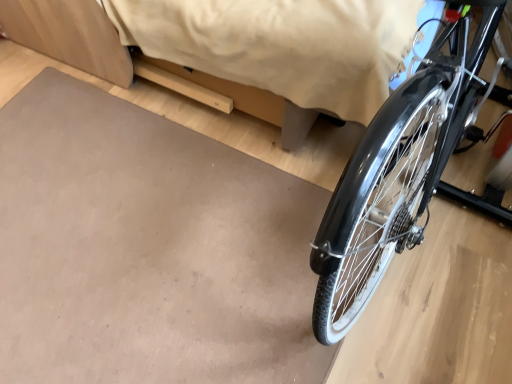
Question: Is matte gray mat at lower right shorter than matte beige bed at upper center?

Choices:
 (A) no
 (B) yes

Answer: (B)

Question: Considering the relative sizes of matte gray mat at lower right and matte beige bed at upper center in the image provided, is matte gray mat at lower right smaller than matte beige bed at upper center?

Choices:
 (A) yes
 (B) no

Answer: (A)

Question: Is matte gray mat at lower right in front of matte beige bed at upper center?

Choices:
 (A) no
 (B) yes

Answer: (A)

Question: Does matte gray mat at lower right have a larger size compared to matte beige bed at upper center?

Choices:
 (A) no
 (B) yes

Answer: (A)

Question: Is matte beige bed at upper center inside matte gray mat at lower right?

Choices:
 (A) no
 (B) yes

Answer: (A)

Question: Is matte gray mat at lower right positioned far away from matte beige bed at upper center?

Choices:
 (A) no
 (B) yes

Answer: (A)

Question: From the image's perspective, does matte beige bed at upper center appear lower than matte gray mat at lower right?

Choices:
 (A) yes
 (B) no

Answer: (B)

Question: Does matte beige bed at upper center appear on the right side of matte gray mat at lower right?

Choices:
 (A) yes
 (B) no

Answer: (A)

Question: Considering the relative positions of matte beige bed at upper center and matte gray mat at lower right in the image provided, is matte beige bed at upper center to the left of matte gray mat at lower right from the viewer's perspective?

Choices:
 (A) yes
 (B) no

Answer: (B)

Question: Is matte beige bed at upper center located outside matte gray mat at lower right?

Choices:
 (A) yes
 (B) no

Answer: (A)

Question: Is matte beige bed at upper center placed right next to matte gray mat at lower right?

Choices:
 (A) no
 (B) yes

Answer: (A)

Question: From a real-world perspective, is matte beige bed at upper center over matte gray mat at lower right?

Choices:
 (A) no
 (B) yes

Answer: (B)

Question: Would you say matte gray mat at lower right is to the left or to the right of matte beige bed at upper center in the picture?

Choices:
 (A) right
 (B) left

Answer: (B)